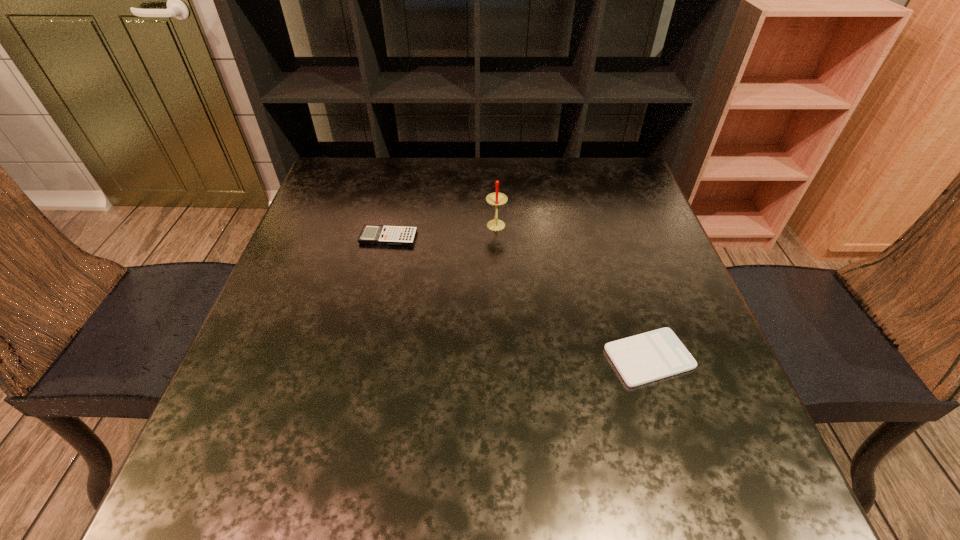
At what (x,y) coordinates should I click in order to perform the action: click on blank area in the image that satisfies the following two spatial constraints: 1. on the back side of the second object from left to right; 2. on the left side of the left calculator. Please return your answer as a coordinate pair (x, y). The image size is (960, 540). Looking at the image, I should click on (391, 227).

Where is `vacant space that satisfies the following two spatial constraints: 1. on the front side of the right calculator; 2. on the left side of the tallest object`? vacant space that satisfies the following two spatial constraints: 1. on the front side of the right calculator; 2. on the left side of the tallest object is located at coordinates (501, 357).

The height and width of the screenshot is (540, 960). What are the coordinates of `vacant region that satisfies the following two spatial constraints: 1. on the front side of the left calculator; 2. on the right side of the nearer calculator` in the screenshot? It's located at (361, 357).